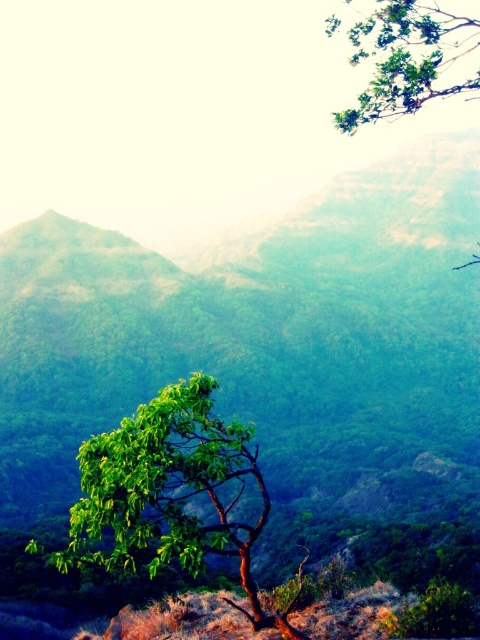
Does green leafy tree at center have a greater height compared to green leafy tree at upper right?

No, green leafy tree at center is not taller than green leafy tree at upper right.

Does green leafy tree at center have a larger size compared to green leafy tree at upper right?

Incorrect, green leafy tree at center is not larger than green leafy tree at upper right.

At what (x,y) coordinates should I click in order to perform the action: click on green leafy tree at center. Please return your answer as a coordinate pair (x, y). This screenshot has height=640, width=480. Looking at the image, I should click on (170, 493).

Image resolution: width=480 pixels, height=640 pixels. In order to click on green leafy tree at center in this screenshot , I will do `click(170, 493)`.